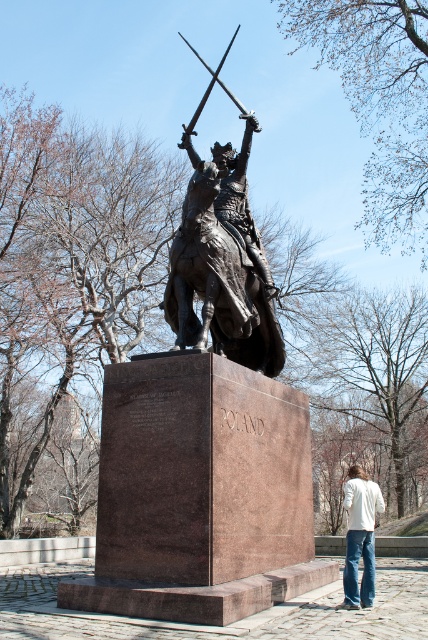
Question: Observing the image, what is the correct spatial positioning of bronze statue at center in reference to white cotton shirt at lower right?

Choices:
 (A) below
 (B) above

Answer: (B)

Question: Does bronze statue at center have a lesser width compared to white cotton shirt at lower right?

Choices:
 (A) yes
 (B) no

Answer: (A)

Question: Is bronze statue at center above white cotton shirt at lower right?

Choices:
 (A) yes
 (B) no

Answer: (A)

Question: Which of the following is the closest to the observer?

Choices:
 (A) (219, 157)
 (B) (372, 500)

Answer: (B)

Question: Which object is farther from the camera taking this photo?

Choices:
 (A) bronze statue at center
 (B) white cotton shirt at lower right

Answer: (A)